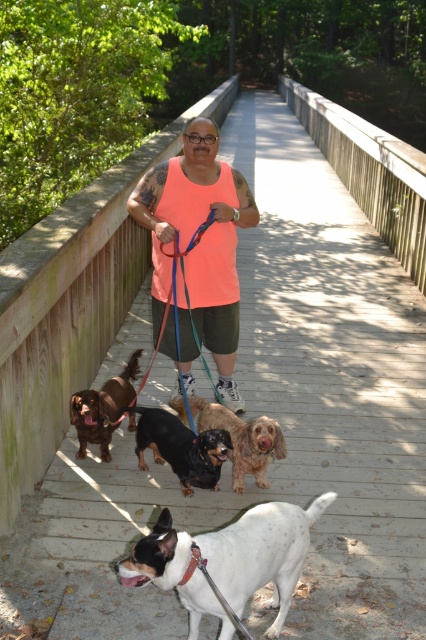
Based on the photo, is neon orange tank top at center behind brown fur dog at center?

That is False.

Who is more forward, (181,225) or (120,372)?

Positioned in front is point (181,225).

Is point (161, 276) closer to viewer compared to point (89, 413)?

No, it is behind (89, 413).

Identify the location of neon orange tank top at center. (x=199, y=241).

Does white speckled fur at center appear on the right side of shiny brown fur at center?

Indeed, white speckled fur at center is positioned on the right side of shiny brown fur at center.

Looking at this image, can you confirm if white speckled fur at center is smaller than shiny brown fur at center?

Incorrect, white speckled fur at center is not smaller in size than shiny brown fur at center.

What do you see at coordinates (229, 561) in the screenshot? The width and height of the screenshot is (426, 640). I see `white speckled fur at center` at bounding box center [229, 561].

Identify the location of white speckled fur at center. (229, 561).

Can you confirm if brown fur dog at center is positioned to the left of blue fabric leash at center?

Yes, brown fur dog at center is to the left of blue fabric leash at center.

Who is more distant from viewer, (126, 387) or (184, 397)?

Point (126, 387)

Locate an element on the screen. brown fur dog at center is located at coordinates (103, 408).